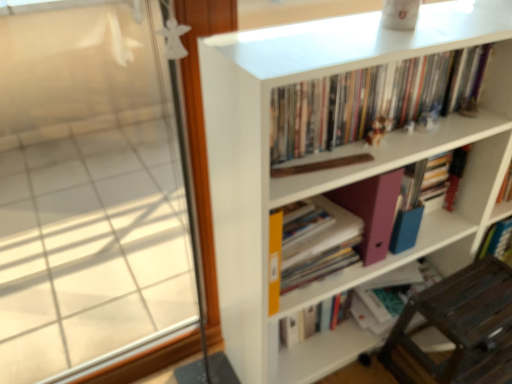
Question: Is white matte bookcase at upper right not within hardcover book at center, the 3th book when ordered from bottom to top?

Choices:
 (A) no
 (B) yes

Answer: (B)

Question: Can you confirm if white matte bookcase at upper right is positioned to the left of hardcover book at center, which is counted as the second book, starting from the top?

Choices:
 (A) yes
 (B) no

Answer: (A)

Question: From the image's perspective, is white matte bookcase at upper right under hardcover book at center, the 3th book when ordered from bottom to top?

Choices:
 (A) no
 (B) yes

Answer: (B)

Question: Is white matte bookcase at upper right to the right of hardcover book at center, which is counted as the second book, starting from the top, from the viewer's perspective?

Choices:
 (A) no
 (B) yes

Answer: (A)

Question: Does white matte bookcase at upper right turn towards hardcover book at center, the 3th book when ordered from bottom to top?

Choices:
 (A) no
 (B) yes

Answer: (B)

Question: Is white matte bookcase at upper right facing away from hardcover book at center, the 3th book when ordered from bottom to top?

Choices:
 (A) yes
 (B) no

Answer: (A)

Question: Considering the relative sizes of hardcover books at upper center, the 4th book ordered from the bottom, and matte pink folder at lower center, arranged as the first book when ordered from the bottom, in the image provided, is hardcover books at upper center, the 4th book ordered from the bottom, bigger than matte pink folder at lower center, arranged as the first book when ordered from the bottom,?

Choices:
 (A) no
 (B) yes

Answer: (B)

Question: From the image's perspective, does hardcover books at upper center, the 4th book ordered from the bottom, appear higher than matte pink folder at lower center, which is counted as the 4th book, starting from the top?

Choices:
 (A) no
 (B) yes

Answer: (B)

Question: From a real-world perspective, is hardcover books at upper center, the 4th book ordered from the bottom, positioned under matte pink folder at lower center, which is counted as the 4th book, starting from the top, based on gravity?

Choices:
 (A) no
 (B) yes

Answer: (A)

Question: Considering the relative sizes of hardcover books at upper center, which is the 1th book in top-to-bottom order, and matte pink folder at lower center, which is counted as the 4th book, starting from the top, in the image provided, is hardcover books at upper center, which is the 1th book in top-to-bottom order, shorter than matte pink folder at lower center, which is counted as the 4th book, starting from the top,?

Choices:
 (A) no
 (B) yes

Answer: (A)

Question: Is hardcover books at upper center, the 4th book ordered from the bottom, far away from matte pink folder at lower center, which is counted as the 4th book, starting from the top?

Choices:
 (A) yes
 (B) no

Answer: (B)

Question: Can matte pink folder at lower center, arranged as the first book when ordered from the bottom, be found inside hardcover books at upper center, the 4th book ordered from the bottom?

Choices:
 (A) yes
 (B) no

Answer: (B)

Question: Can you confirm if yellow matte folder at center, which is the third book from top to bottom, is taller than white matte bookcase at upper right?

Choices:
 (A) yes
 (B) no

Answer: (B)